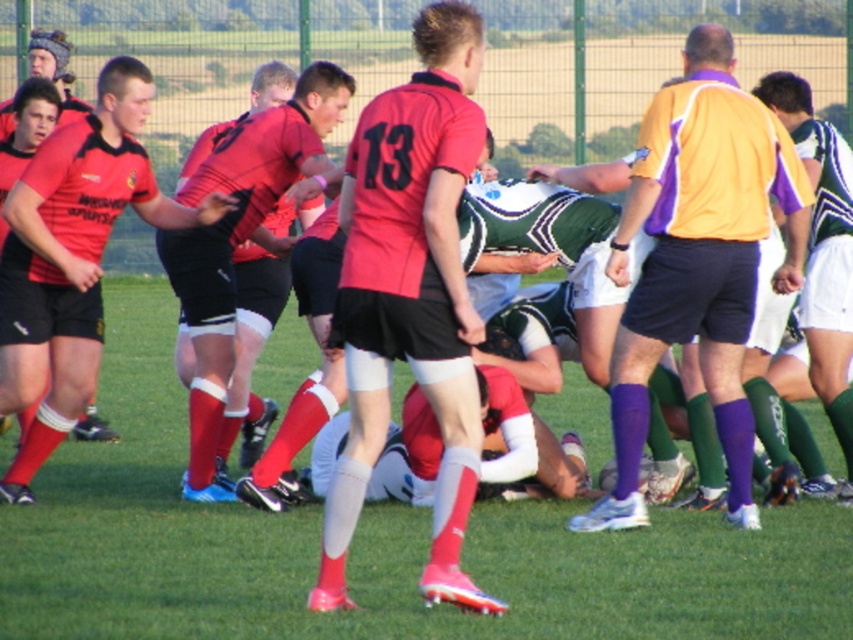
You are a photographer standing at the edge of the rugby field. You want to take a photo of the two points marked in the image. Which point, point [402,195] or point [723,417], will appear larger in your photo?

Point [402,195] will appear larger in the photo because it is closer to the viewer than point [723,417].

You are a spectator at the rugby match and want to take a photo of both the matte red socks at center and the green striped jersey at center. Which object should you zoom in on to ensure both are clearly visible in the photo?

The matte red socks at center is bigger than the green striped jersey at center, so you should zoom in on the matte red socks at center to ensure both are clearly visible in the photo.

You are a spectator at the rugby match. You notice two officials on the field. One is wearing a matte red jersey at center and the other an orange and purple jersey at center. Which official is closer to you?

The matte red jersey at center is closer to you because it is in front of the orange and purple jersey at center.